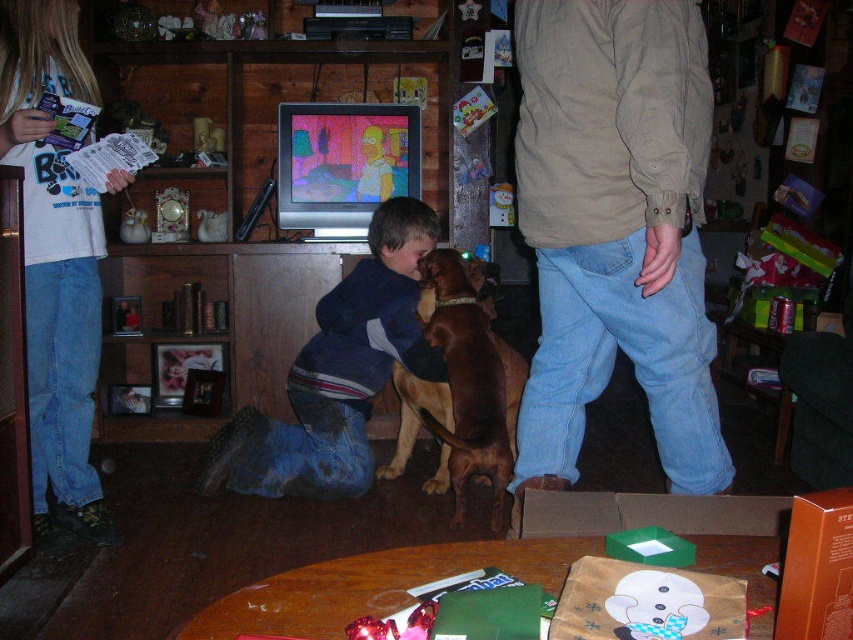
The width and height of the screenshot is (853, 640). What do you see at coordinates (616, 228) in the screenshot? I see `light brown corduroy shirt at center` at bounding box center [616, 228].

Is point (558, 401) closer to viewer compared to point (396, 376)?

Yes.

Where is `light brown corduroy shirt at center`? The height and width of the screenshot is (640, 853). light brown corduroy shirt at center is located at coordinates (616, 228).

Consider the image. Is denim jeans at center in front of brown shiny dog at center?

No, it is not.

I want to click on denim jeans at center, so click(x=337, y=372).

Find the location of a particular element. This screenshot has height=640, width=853. denim jeans at center is located at coordinates (337, 372).

Is light brown corduroy shirt at center shorter than denim jeans at center?

No, light brown corduroy shirt at center is not shorter than denim jeans at center.

What do you see at coordinates (616, 228) in the screenshot?
I see `light brown corduroy shirt at center` at bounding box center [616, 228].

What do you see at coordinates (616, 228) in the screenshot? I see `light brown corduroy shirt at center` at bounding box center [616, 228].

Identify the location of light brown corduroy shirt at center. This screenshot has height=640, width=853. (616, 228).